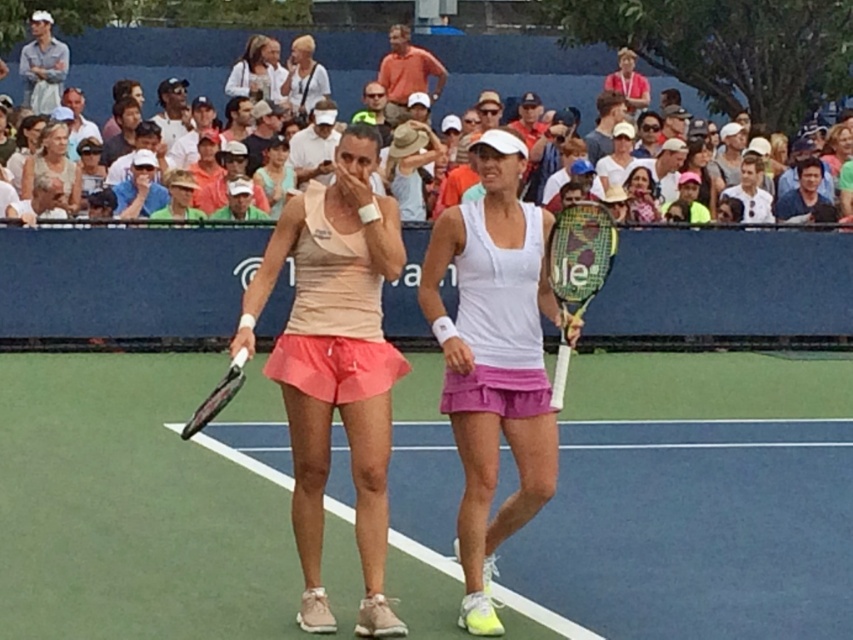
Question: Estimate the real-world distances between objects in this image. Which object is closer to the white matte tennis skirt at center?

Choices:
 (A) matte white tank top at center
 (B) white cotton hats at upper center

Answer: (A)

Question: Can you confirm if matte peach tank top at center is bigger than black matte tennis racket at left?

Choices:
 (A) no
 (B) yes

Answer: (B)

Question: Which object appears farthest from the camera in this image?

Choices:
 (A) black matte tennis racket at left
 (B) matte white tank top at center

Answer: (B)

Question: Is pink fabric tennis court at center smaller than matte peach tank top at center?

Choices:
 (A) yes
 (B) no

Answer: (B)

Question: Can you confirm if white textured racket at center is positioned above matte white tank top at center?

Choices:
 (A) yes
 (B) no

Answer: (B)

Question: Among these points, which one is nearest to the camera?

Choices:
 (A) (578, 259)
 (B) (318, 45)
 (C) (267, 604)
 (D) (271, 192)

Answer: (A)